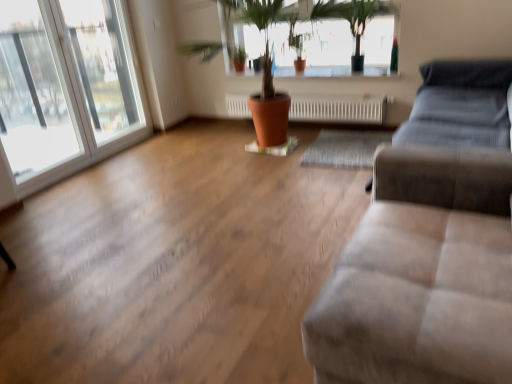
Question: From their relative heights in the image, would you say suede-like beige couch at lower right is taller or shorter than white textured radiator at center?

Choices:
 (A) tall
 (B) short

Answer: (A)

Question: From the image's perspective, is suede-like beige couch at lower right located above or below white textured radiator at center?

Choices:
 (A) below
 (B) above

Answer: (A)

Question: Which object is positioned farthest from the transparent glass window at left, placed as the first window when sorted from right to left?

Choices:
 (A) green leafy plant at upper center
 (B) transparent glass window at left, the 2th window viewed from the right
 (C) terracotta clay pot at center
 (D) suede-like beige couch at lower right
 (E) white textured radiator at center

Answer: (D)

Question: Which object is the closest to the suede-like beige couch at lower right?

Choices:
 (A) white textured radiator at center
 (B) green leafy plant at upper center
 (C) transparent glass window at left, placed as the first window when sorted from right to left
 (D) terracotta clay pot at center
 (E) transparent glass window at left, the 2th window viewed from the right

Answer: (B)